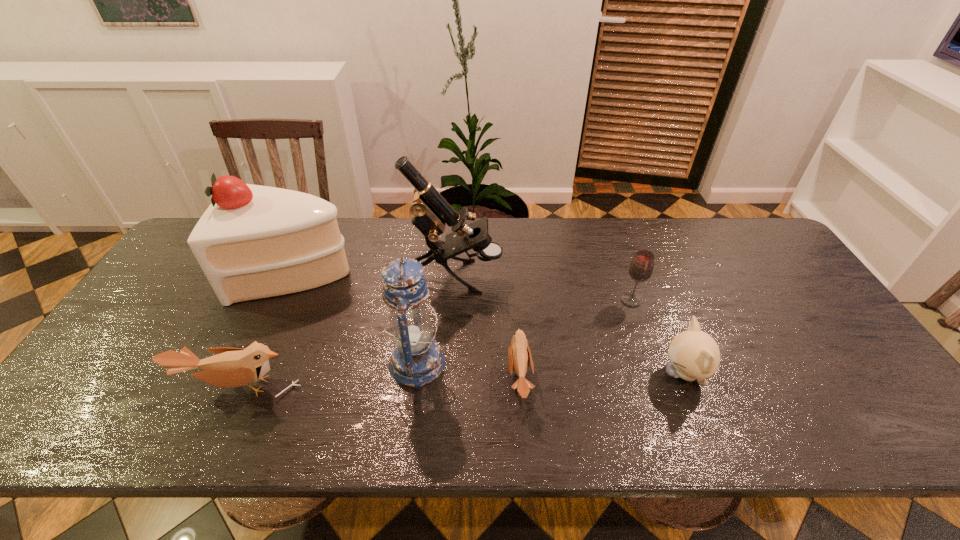
Locate an element on the screen. vacant space at the far edge of the desktop is located at coordinates (359, 247).

Find the location of a particular element. blank space at the near edge of the desktop is located at coordinates (320, 396).

Where is `blank space at the left edge of the desktop`? The width and height of the screenshot is (960, 540). blank space at the left edge of the desktop is located at coordinates (118, 361).

This screenshot has width=960, height=540. I want to click on free space at the right edge, so click(811, 320).

Identify the location of vacant space at the far left corner of the desktop. This screenshot has height=540, width=960. (189, 261).

In the image, there is a desktop. Identify the location of vacant space at the near left corner. (112, 395).

In the image, there is a desktop. At what (x,y) coordinates should I click in order to perform the action: click on vacant region at the far right corner. Please return your answer as a coordinate pair (x, y). This screenshot has width=960, height=540. Looking at the image, I should click on (734, 219).

Identify the location of empty location between the microscope and the glass drink container. (543, 288).

Where is `vacant point located between the lantern and the kitten`? vacant point located between the lantern and the kitten is located at coordinates (551, 368).

Locate an element on the screen. unoccupied area between the lantern and the left bird is located at coordinates (327, 375).